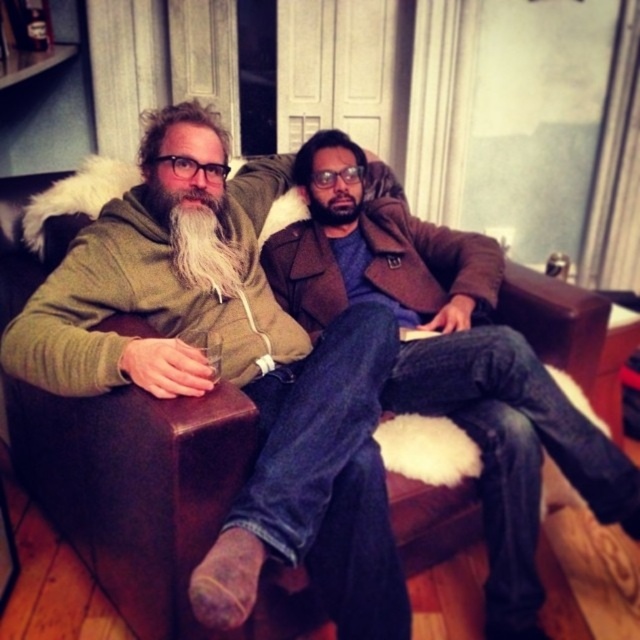
Question: Is brown leather couch at center wider than white fuzzy beard at left?

Choices:
 (A) no
 (B) yes

Answer: (B)

Question: Where is brown leather couch at center located in relation to white fuzzy beard at left in the image?

Choices:
 (A) below
 (B) above

Answer: (A)

Question: Can you confirm if brown leather couch at center is smaller than white fuzzy beard at left?

Choices:
 (A) no
 (B) yes

Answer: (A)

Question: Which point is farther from the camera taking this photo?

Choices:
 (A) (230, 276)
 (B) (557, 289)

Answer: (B)

Question: Which object appears closest to the camera in this image?

Choices:
 (A) white fuzzy beard at left
 (B) brown leather couch at center

Answer: (B)